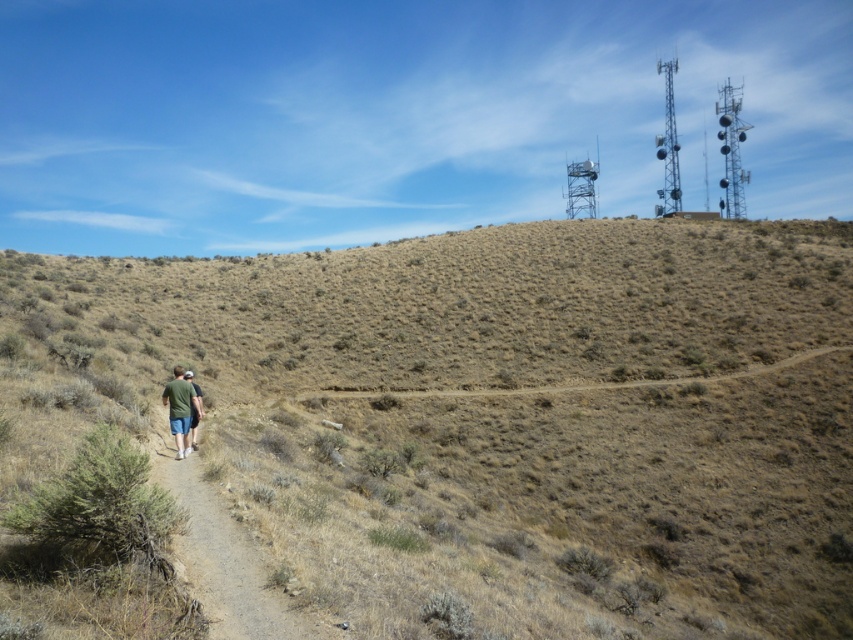
You are planning to walk along the dirt path at lower left and want to avoid stepping on the brown dry grass at center. Based on their widths, which path is wider and safer to walk on?

The brown dry grass at center is wider than the dirt path at lower left, so the dirt path at lower left is narrower. Therefore, walking on the dirt path at lower left might be safer as it is intended for walking and avoids the grass area, though the grass area is wider it may not be suitable for walking due to its vegetation.